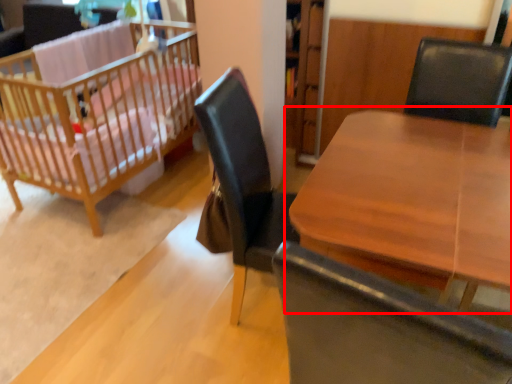
Question: Observing the image, what is the correct spatial positioning of table (annotated by the red box) in reference to infant bed?

Choices:
 (A) right
 (B) left

Answer: (A)